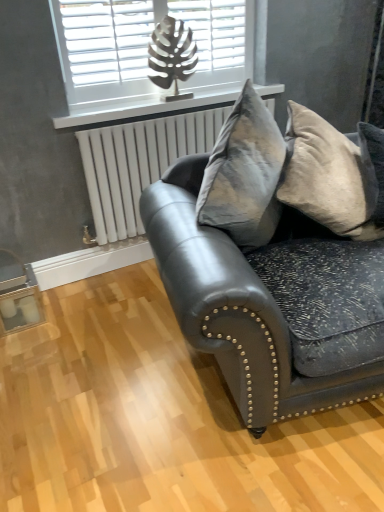
Question: Is white matte window at upper center closer to camera compared to matte black leather couch at center?

Choices:
 (A) no
 (B) yes

Answer: (A)

Question: Is white matte window at upper center bigger than matte black leather couch at center?

Choices:
 (A) no
 (B) yes

Answer: (A)

Question: Is white matte window at upper center to the right of matte black leather couch at center from the viewer's perspective?

Choices:
 (A) no
 (B) yes

Answer: (A)

Question: Considering the relative sizes of white matte window at upper center and matte black leather couch at center in the image provided, is white matte window at upper center taller than matte black leather couch at center?

Choices:
 (A) no
 (B) yes

Answer: (A)

Question: Considering the relative sizes of white matte window at upper center and matte black leather couch at center in the image provided, is white matte window at upper center wider than matte black leather couch at center?

Choices:
 (A) no
 (B) yes

Answer: (A)

Question: From a real-world perspective, is white metallic radiator at upper center physically located above or below white matte window at upper center?

Choices:
 (A) below
 (B) above

Answer: (A)

Question: Considering the positions of white metallic radiator at upper center and white matte window at upper center in the image, is white metallic radiator at upper center taller or shorter than white matte window at upper center?

Choices:
 (A) short
 (B) tall

Answer: (B)

Question: Would you say white metallic radiator at upper center is inside or outside white matte window at upper center?

Choices:
 (A) inside
 (B) outside

Answer: (B)

Question: Considering the positions of white metallic radiator at upper center and white matte window at upper center in the image, is white metallic radiator at upper center bigger or smaller than white matte window at upper center?

Choices:
 (A) big
 (B) small

Answer: (A)

Question: From a real-world perspective, is white metallic radiator at upper center positioned above or below velvet gray pillow at right?

Choices:
 (A) above
 (B) below

Answer: (B)

Question: In terms of size, does white metallic radiator at upper center appear bigger or smaller than velvet gray pillow at right?

Choices:
 (A) big
 (B) small

Answer: (B)

Question: Is white metallic radiator at upper center in front of or behind velvet gray pillow at right in the image?

Choices:
 (A) front
 (B) behind

Answer: (B)

Question: Is white metallic radiator at upper center wider or thinner than velvet gray pillow at right?

Choices:
 (A) wide
 (B) thin

Answer: (B)

Question: Relative to matte black leather couch at center, is white plastic radiator at upper center in front or behind?

Choices:
 (A) front
 (B) behind

Answer: (B)

Question: Is point (198, 106) closer or farther from the camera than point (345, 375)?

Choices:
 (A) closer
 (B) farther

Answer: (B)